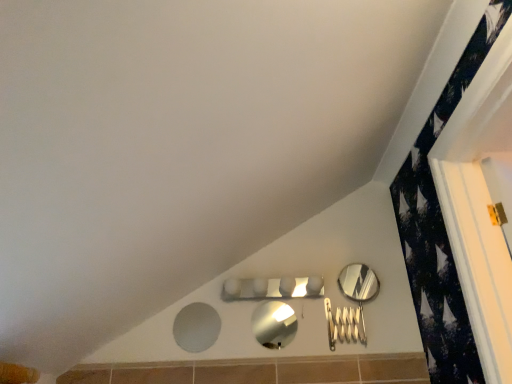
Measure the distance between matte gray mirror at lower center, the third mirror positioned from the right, and camera.

1.78 meters.

Identify the location of polished silver mirror at right, the third mirror in the left-to-right sequence. (358, 282).

Is polished silver mirror at right, which appears as the 1th mirror when viewed from the right, turned away from matte gray mirror at lower center, the third mirror positioned from the right?

No, polished silver mirror at right, which appears as the 1th mirror when viewed from the right, is not facing the opposite direction of matte gray mirror at lower center, the third mirror positioned from the right.

Between polished silver mirror at right, which appears as the 1th mirror when viewed from the right, and matte gray mirror at lower center, the third mirror positioned from the right, which one has larger width?

With larger width is polished silver mirror at right, which appears as the 1th mirror when viewed from the right.

Is polished silver mirror at right, which appears as the 1th mirror when viewed from the right, taller or shorter than matte gray mirror at lower center, the 1th mirror positioned from the left?

Considering their sizes, polished silver mirror at right, which appears as the 1th mirror when viewed from the right, has less height than matte gray mirror at lower center, the 1th mirror positioned from the left.

Identify the location of mirror behind the matte gray mirror at lower center, the 1th mirror positioned from the left. (358, 282).

Is metallic silver mirror at center, which is the 2th mirror in left-to-right order, positioned with its back to matte gray mirror at lower center, the 1th mirror positioned from the left?

That's not correct — metallic silver mirror at center, which is the 2th mirror in left-to-right order, is not looking away from matte gray mirror at lower center, the 1th mirror positioned from the left.

You are a GUI agent. You are given a task and a screenshot of the screen. Output one action in this format:
    pyautogui.click(x=<x>, y=<y>)
    Task: Click on the 1st mirror behind when counting from the metallic silver mirror at center, which is the 2th mirror in left-to-right order
    This screenshot has height=384, width=512.
    Given the screenshot: What is the action you would take?
    pyautogui.click(x=196, y=327)

Based on the photo, are metallic silver mirror at center, which is the 2th mirror in left-to-right order, and matte gray mirror at lower center, the third mirror positioned from the right, far apart?

Actually, metallic silver mirror at center, which is the 2th mirror in left-to-right order, and matte gray mirror at lower center, the third mirror positioned from the right, are a little close together.

Between metallic silver mirror at center, the second mirror in the right-to-left sequence, and matte gray mirror at lower center, the third mirror positioned from the right, which one has larger size?

With larger size is metallic silver mirror at center, the second mirror in the right-to-left sequence.

Between metallic silver mirror at center, the second mirror in the right-to-left sequence, and polished silver mirror at right, the third mirror in the left-to-right sequence, which one has smaller width?

With smaller width is polished silver mirror at right, the third mirror in the left-to-right sequence.

In the scene shown: Does metallic silver mirror at center, which is the 2th mirror in left-to-right order, have a greater height compared to polished silver mirror at right, which appears as the 1th mirror when viewed from the right?

In fact, metallic silver mirror at center, which is the 2th mirror in left-to-right order, may be shorter than polished silver mirror at right, which appears as the 1th mirror when viewed from the right.

From the image's perspective, between metallic silver mirror at center, the second mirror in the right-to-left sequence, and polished silver mirror at right, which appears as the 1th mirror when viewed from the right, who is located below?

metallic silver mirror at center, the second mirror in the right-to-left sequence.

Is metallic silver mirror at center, the second mirror in the right-to-left sequence, bigger than polished silver mirror at right, which appears as the 1th mirror when viewed from the right?

No, metallic silver mirror at center, the second mirror in the right-to-left sequence, is not bigger than polished silver mirror at right, which appears as the 1th mirror when viewed from the right.

Can you tell me how much polished silver mirror at right, which appears as the 1th mirror when viewed from the right, and metallic silver mirror at center, the second mirror in the right-to-left sequence, differ in facing direction?

The facing directions of polished silver mirror at right, which appears as the 1th mirror when viewed from the right, and metallic silver mirror at center, the second mirror in the right-to-left sequence, are 1.77 degrees apart.

Is point (342, 290) positioned behind point (259, 322)?

Yes, it is behind point (259, 322).

Who is shorter, polished silver mirror at right, the third mirror in the left-to-right sequence, or metallic silver mirror at center, which is the 2th mirror in left-to-right order?

metallic silver mirror at center, which is the 2th mirror in left-to-right order, is shorter.

How distant is polished silver mirror at right, the third mirror in the left-to-right sequence, from metallic silver mirror at center, which is the 2th mirror in left-to-right order?

polished silver mirror at right, the third mirror in the left-to-right sequence, is 14.89 inches from metallic silver mirror at center, which is the 2th mirror in left-to-right order.

From the image's perspective, would you say matte gray mirror at lower center, the 1th mirror positioned from the left, is shown under polished silver mirror at right, which appears as the 1th mirror when viewed from the right?

Yes, from the image's perspective, matte gray mirror at lower center, the 1th mirror positioned from the left, is below polished silver mirror at right, which appears as the 1th mirror when viewed from the right.

Which mirror is the 2nd one when counting from the right side of the matte gray mirror at lower center, the 1th mirror positioned from the left? Please provide its 2D coordinates.

[(358, 282)]

Which of these two, matte gray mirror at lower center, the 1th mirror positioned from the left, or polished silver mirror at right, which appears as the 1th mirror when viewed from the right, is thinner?

matte gray mirror at lower center, the 1th mirror positioned from the left, is thinner.

Does point (206, 316) lie in front of point (256, 319)?

No, (206, 316) is further to viewer.

Is matte gray mirror at lower center, the third mirror positioned from the right, next to metallic silver mirror at center, the second mirror in the right-to-left sequence?

No.

Is matte gray mirror at lower center, the 1th mirror positioned from the left, oriented away from metallic silver mirror at center, the second mirror in the right-to-left sequence?

That's not correct — matte gray mirror at lower center, the 1th mirror positioned from the left, is not looking away from metallic silver mirror at center, the second mirror in the right-to-left sequence.

The image size is (512, 384). I want to click on mirror behind the matte gray mirror at lower center, the third mirror positioned from the right, so click(358, 282).

Find the location of a particular element. mirror below the metallic silver mirror at center, which is the 2th mirror in left-to-right order (from the image's perspective) is located at coordinates (196, 327).

When comparing their distances from polished silver mirror at right, which appears as the 1th mirror when viewed from the right, does matte gray mirror at lower center, the third mirror positioned from the right, or metallic silver mirror at center, the second mirror in the right-to-left sequence, seem closer?

metallic silver mirror at center, the second mirror in the right-to-left sequence, lies closer to polished silver mirror at right, which appears as the 1th mirror when viewed from the right, than the other object.

Based on their spatial positions, is matte gray mirror at lower center, the 1th mirror positioned from the left, or polished silver mirror at right, the third mirror in the left-to-right sequence, further from metallic silver mirror at center, the second mirror in the right-to-left sequence?

polished silver mirror at right, the third mirror in the left-to-right sequence, lies further to metallic silver mirror at center, the second mirror in the right-to-left sequence, than the other object.

Which object lies further to the anchor point matte gray mirror at lower center, the 1th mirror positioned from the left, polished silver mirror at right, the third mirror in the left-to-right sequence, or metallic silver mirror at center, which is the 2th mirror in left-to-right order?

polished silver mirror at right, the third mirror in the left-to-right sequence.

From the image, which object appears to be farther from metallic silver mirror at center, which is the 2th mirror in left-to-right order, polished silver mirror at right, the third mirror in the left-to-right sequence, or matte gray mirror at lower center, the third mirror positioned from the right?

polished silver mirror at right, the third mirror in the left-to-right sequence, lies further to metallic silver mirror at center, which is the 2th mirror in left-to-right order, than the other object.

Based on their spatial positions, is metallic silver mirror at center, which is the 2th mirror in left-to-right order, or polished silver mirror at right, the third mirror in the left-to-right sequence, further from matte gray mirror at lower center, the third mirror positioned from the right?

Based on the image, polished silver mirror at right, the third mirror in the left-to-right sequence, appears to be further to matte gray mirror at lower center, the third mirror positioned from the right.

Estimate the real-world distances between objects in this image. Which object is closer to polished silver mirror at right, the third mirror in the left-to-right sequence, metallic silver mirror at center, the second mirror in the right-to-left sequence, or matte gray mirror at lower center, the third mirror positioned from the right?

Among the two, metallic silver mirror at center, the second mirror in the right-to-left sequence, is located nearer to polished silver mirror at right, the third mirror in the left-to-right sequence.

Where is `mirror between matte gray mirror at lower center, the 1th mirror positioned from the left, and polished silver mirror at right, the third mirror in the left-to-right sequence`? mirror between matte gray mirror at lower center, the 1th mirror positioned from the left, and polished silver mirror at right, the third mirror in the left-to-right sequence is located at coordinates (274, 324).